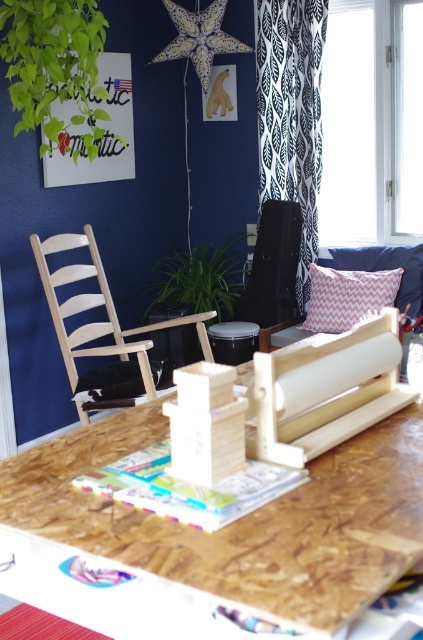
Question: Does wooden blocks at center appear on the left side of pink chevron pillow at center?

Choices:
 (A) yes
 (B) no

Answer: (A)

Question: Among these points, which one is farthest from the camera?

Choices:
 (A) (214, 52)
 (B) (387, 264)
 (C) (304, 118)

Answer: (A)

Question: Can you confirm if black leather chair at center is bigger than white chevron pillow at center?

Choices:
 (A) no
 (B) yes

Answer: (B)

Question: Which of the following is the closest to the observer?

Choices:
 (A) wooden table at center
 (B) white chevron pillow at center
 (C) light wood chair at left

Answer: (A)

Question: Among these objects, which one is farthest from the camera?

Choices:
 (A) white chevron pillow at center
 (B) light wood chair at left
 (C) pink chevron cushion at upper right

Answer: (C)

Question: Can you confirm if wooden table at center is positioned below white chevron pillow at center?

Choices:
 (A) yes
 (B) no

Answer: (A)